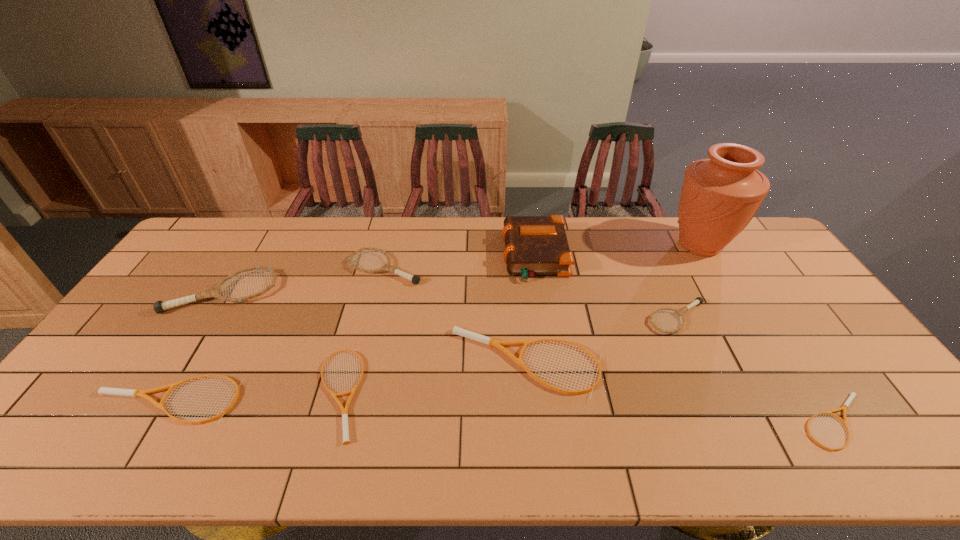
This screenshot has width=960, height=540. In order to click on free region at the far right corner of the desktop in this screenshot , I will do `click(755, 238)`.

Locate an element on the screen. The width and height of the screenshot is (960, 540). free point between the second beige tennis racket from right to left and the second shortest tennis racket is located at coordinates (432, 379).

Locate an element on the screen. The image size is (960, 540). free space between the Bible and the rightmost beige tennis racket is located at coordinates (685, 340).

The height and width of the screenshot is (540, 960). I want to click on free space between the tallest object and the rightmost gray tennis racket, so click(x=688, y=281).

The image size is (960, 540). What are the coordinates of `unoccupied position between the fourth tallest object and the shortest object` in the screenshot? It's located at (610, 346).

Find the location of a particular element. The height and width of the screenshot is (540, 960). unoccupied position between the Bible and the shortest object is located at coordinates (685, 340).

Identify the location of free space that is in between the third tennis racket from right to left and the smallest beige tennis racket. (682, 393).

This screenshot has width=960, height=540. I want to click on free spot between the rightmost beige tennis racket and the vase, so click(x=767, y=334).

I want to click on empty space between the sixth shortest object and the third beige tennis racket from left to right, so tap(456, 316).

Where is `free space between the seventh shortest object and the eighth shortest object`? This screenshot has height=540, width=960. free space between the seventh shortest object and the eighth shortest object is located at coordinates click(x=379, y=274).